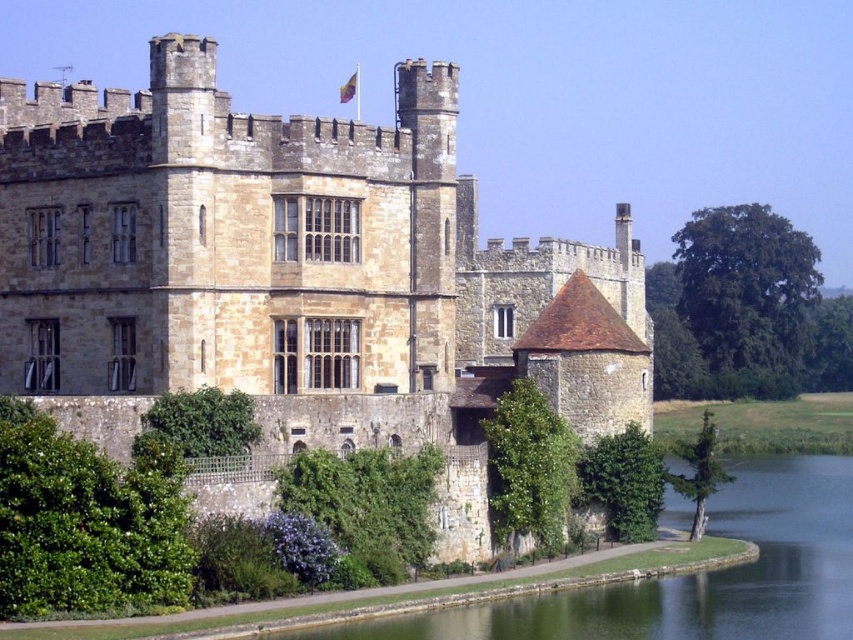
Question: Can you confirm if brown stone castle at center is smaller than green grassy bank at lower center?

Choices:
 (A) yes
 (B) no

Answer: (B)

Question: Which point is farther from the camera taking this photo?

Choices:
 (A) (74, 100)
 (B) (386, 627)

Answer: (A)

Question: Which point is closer to the camera?

Choices:
 (A) (733, 497)
 (B) (413, 106)

Answer: (B)

Question: Is brown stone castle at center behind green grassy bank at lower center?

Choices:
 (A) no
 (B) yes

Answer: (B)

Question: Is brown stone castle at center above green grassy bank at lower center?

Choices:
 (A) yes
 (B) no

Answer: (A)

Question: Which of the following is the closest to the observer?

Choices:
 (A) (498, 292)
 (B) (766, 616)

Answer: (B)